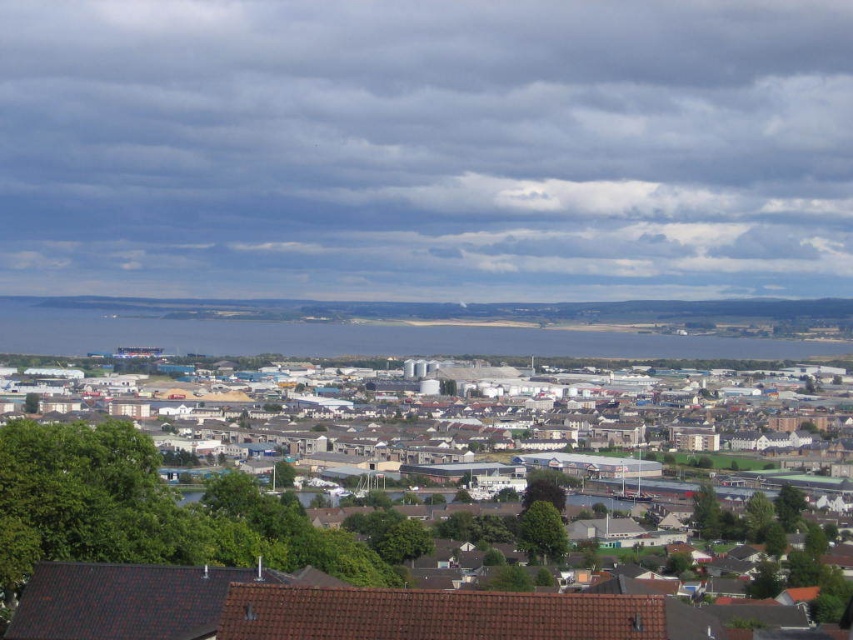
You are standing at the point marked as point [483,417] in the image. What type of structures are you surrounded by?

You are surrounded by industrial buildings at center.

Looking at this image, you are a bird flying over the coastal urban area. You notice the industrial buildings at center and the blue water at center. Which one do you see as taller from your aerial view?

The industrial buildings at center are much taller than the blue water at center, so you see the industrial buildings at center as taller from your aerial view.